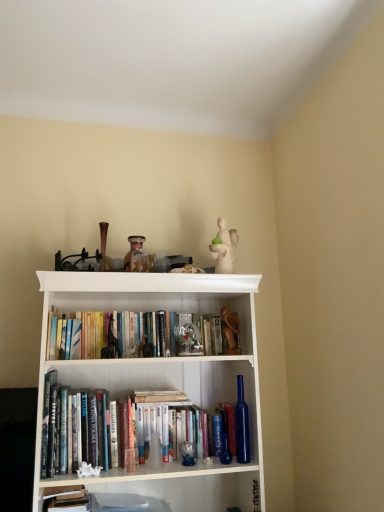
Question: Is white porcelain figurine at upper center, the second toy viewed from the right, bigger than hardcover book at lower left, the first book viewed from the front?

Choices:
 (A) yes
 (B) no

Answer: (A)

Question: Does white porcelain figurine at upper center, arranged as the first toy when viewed from the top, come behind hardcover book at lower left, which is the second book in top-to-bottom order?

Choices:
 (A) no
 (B) yes

Answer: (B)

Question: From a real-world perspective, is white porcelain figurine at upper center, which is counted as the second toy, starting from the left, positioned over hardcover book at lower left, the first book viewed from the front, based on gravity?

Choices:
 (A) no
 (B) yes

Answer: (B)

Question: Considering the relative sizes of white porcelain figurine at upper center, the third toy positioned from the bottom, and hardcover book at lower left, the 1th book when ordered from bottom to top, in the image provided, is white porcelain figurine at upper center, the third toy positioned from the bottom, shorter than hardcover book at lower left, the 1th book when ordered from bottom to top,?

Choices:
 (A) yes
 (B) no

Answer: (B)

Question: From the image's perspective, does white porcelain figurine at upper center, arranged as the first toy when viewed from the top, appear higher than hardcover book at lower left, the 2th book when ordered from back to front?

Choices:
 (A) yes
 (B) no

Answer: (A)

Question: Considering the positions of point (223, 313) and point (89, 339), is point (223, 313) closer or farther from the camera than point (89, 339)?

Choices:
 (A) farther
 (B) closer

Answer: (A)

Question: Considering the positions of wooden figurine at center, the 3th toy in the left-to-right sequence, and hardcover books at center, which is counted as the 2th book, starting from the front, in the image, is wooden figurine at center, the 3th toy in the left-to-right sequence, taller or shorter than hardcover books at center, which is counted as the 2th book, starting from the front,?

Choices:
 (A) short
 (B) tall

Answer: (B)

Question: Is wooden figurine at center, the third toy positioned from the top, wider or thinner than hardcover books at center, the 1th book from the top?

Choices:
 (A) thin
 (B) wide

Answer: (A)

Question: Considering the positions of wooden figurine at center, the 3th toy in the left-to-right sequence, and hardcover books at center, the 1th book from the top, in the image, is wooden figurine at center, the 3th toy in the left-to-right sequence, bigger or smaller than hardcover books at center, the 1th book from the top,?

Choices:
 (A) small
 (B) big

Answer: (A)

Question: Considering the positions of hardcover book at lower left, which is the second book in top-to-bottom order, and matte glass jar at upper center, the 3th toy from the right, in the image, is hardcover book at lower left, which is the second book in top-to-bottom order, taller or shorter than matte glass jar at upper center, the 3th toy from the right,?

Choices:
 (A) short
 (B) tall

Answer: (A)

Question: Considering the positions of point (74, 488) and point (129, 237), is point (74, 488) closer or farther from the camera than point (129, 237)?

Choices:
 (A) closer
 (B) farther

Answer: (A)

Question: Considering the positions of hardcover book at lower left, which is the second book in top-to-bottom order, and matte glass jar at upper center, the 1th toy in the left-to-right sequence, in the image, is hardcover book at lower left, which is the second book in top-to-bottom order, bigger or smaller than matte glass jar at upper center, the 1th toy in the left-to-right sequence,?

Choices:
 (A) big
 (B) small

Answer: (A)

Question: Would you say hardcover book at lower left, the 2th book when ordered from back to front, is inside or outside matte glass jar at upper center, positioned as the 2th toy in top-to-bottom order?

Choices:
 (A) outside
 (B) inside

Answer: (A)

Question: Is hardcover books at center, which is counted as the 2th book, starting from the front, spatially inside white wood bookshelf at center, or outside of it?

Choices:
 (A) inside
 (B) outside

Answer: (A)

Question: From a real-world perspective, is hardcover books at center, arranged as the 1th book when viewed from the back, positioned above or below white wood bookshelf at center?

Choices:
 (A) below
 (B) above

Answer: (B)